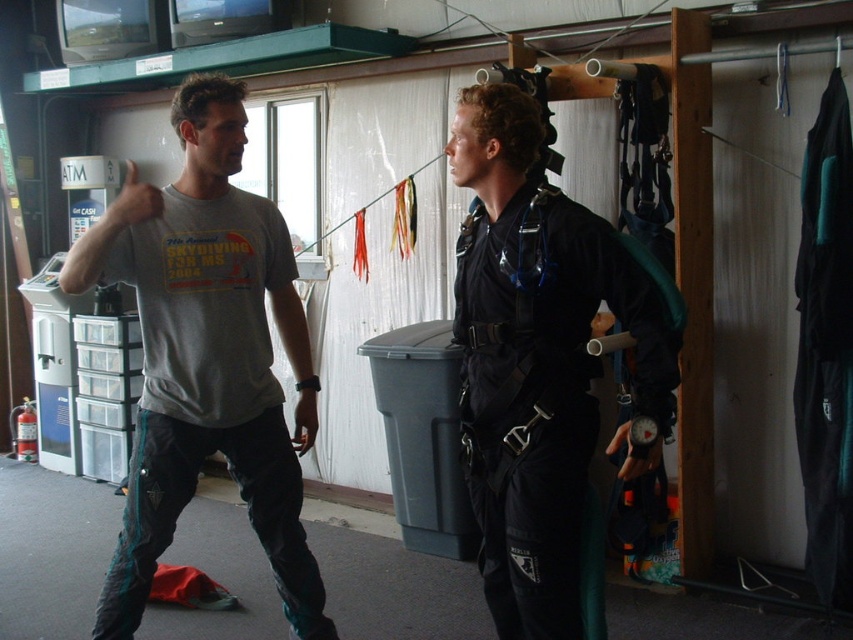
Can you confirm if black matte diving suit at center is positioned to the left of gray cotton t-shirt at upper left?

No, black matte diving suit at center is not to the left of gray cotton t-shirt at upper left.

Which is below, black matte diving suit at center or gray cotton t-shirt at upper left?

gray cotton t-shirt at upper left is below.

This screenshot has width=853, height=640. What do you see at coordinates (543, 364) in the screenshot?
I see `black matte diving suit at center` at bounding box center [543, 364].

Where is `black matte diving suit at center`? This screenshot has width=853, height=640. black matte diving suit at center is located at coordinates [x=543, y=364].